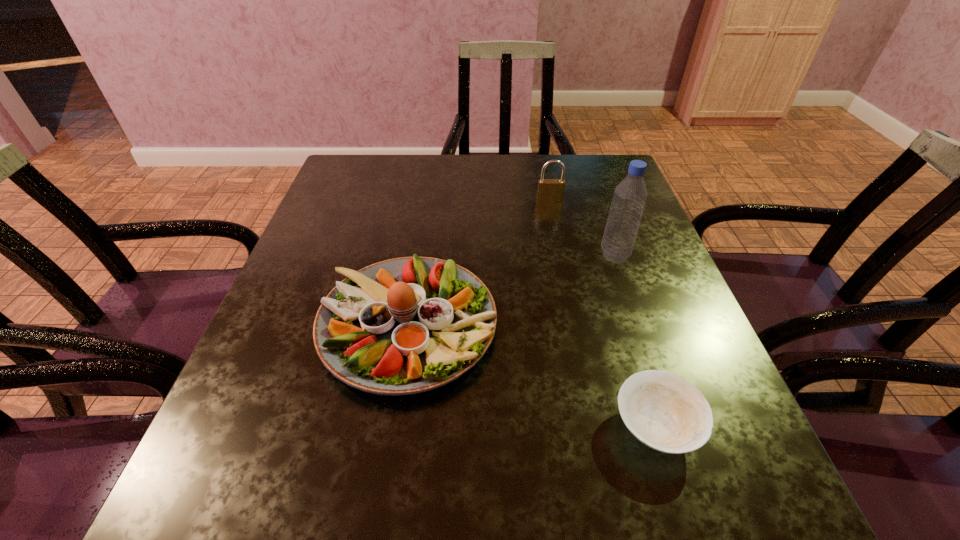
Locate an element on the screen. Image resolution: width=960 pixels, height=540 pixels. object that is the second closest to the shortest object is located at coordinates (629, 198).

I want to click on the second closest object to the salad plate, so click(x=629, y=198).

The image size is (960, 540). In order to click on free space that satisfies the following two spatial constraints: 1. on the back side of the bottle; 2. on the right side of the leftmost object in this screenshot , I will do `click(420, 255)`.

You are a GUI agent. You are given a task and a screenshot of the screen. Output one action in this format:
    pyautogui.click(x=<x>, y=<y>)
    Task: Click on the vacant space that satisfies the following two spatial constraints: 1. on the front side of the salad plate; 2. on the right side of the shortest object
    
    Given the screenshot: What is the action you would take?
    pyautogui.click(x=393, y=427)

Identify the location of vacant space that satisfies the following two spatial constraints: 1. on the front-facing side of the padlock; 2. on the left side of the bottle. Image resolution: width=960 pixels, height=540 pixels. (561, 255).

You are a GUI agent. You are given a task and a screenshot of the screen. Output one action in this format:
    pyautogui.click(x=<x>, y=<y>)
    Task: Click on the free space that satisfies the following two spatial constraints: 1. on the front-facing side of the shortest object; 2. on the right side of the farthest object
    
    Given the screenshot: What is the action you would take?
    pyautogui.click(x=596, y=427)

This screenshot has height=540, width=960. I want to click on vacant position in the image that satisfies the following two spatial constraints: 1. on the front side of the bowl; 2. on the left side of the leftmost object, so click(393, 427).